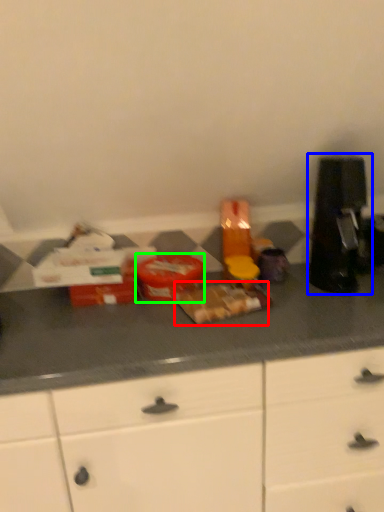
Question: Which object is positioned closest to food (highlighted by a red box)? Select from coffee machine (highlighted by a blue box) and food (highlighted by a green box).

Choices:
 (A) coffee machine
 (B) food

Answer: (B)